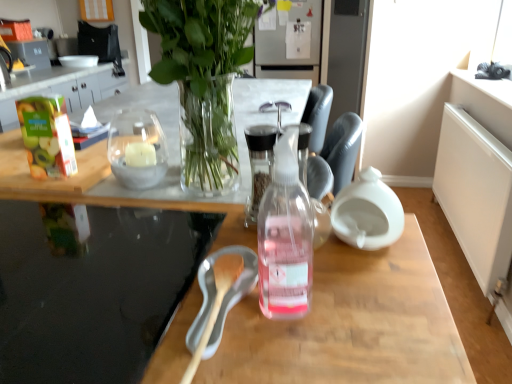
Image resolution: width=512 pixels, height=384 pixels. Identify the location of vacant region to the left of clear glass bottle at center. (170, 302).